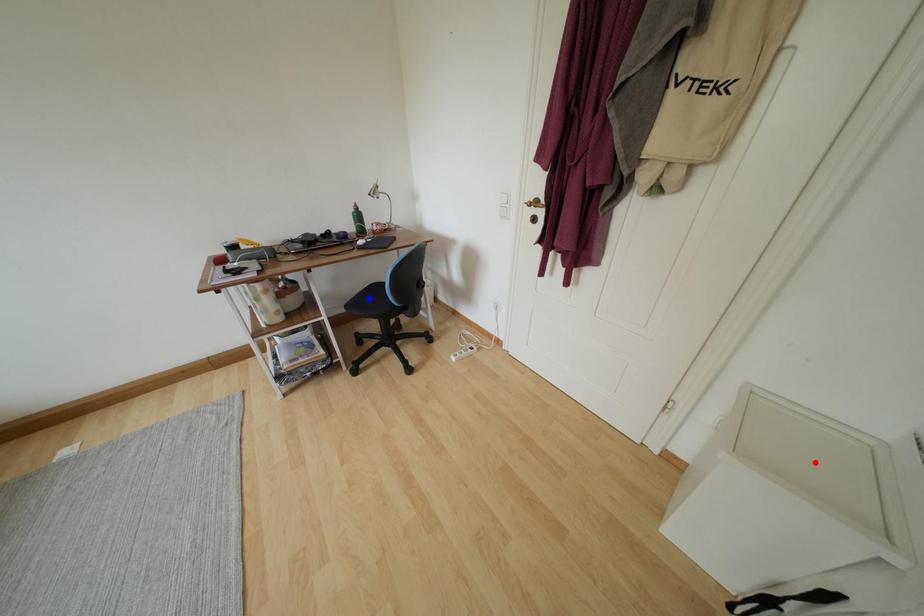
Question: In the image, two points are highlighted. Which point is nearer to the camera? Reply with the corresponding letter.

Choices:
 (A) blue point
 (B) red point

Answer: (B)